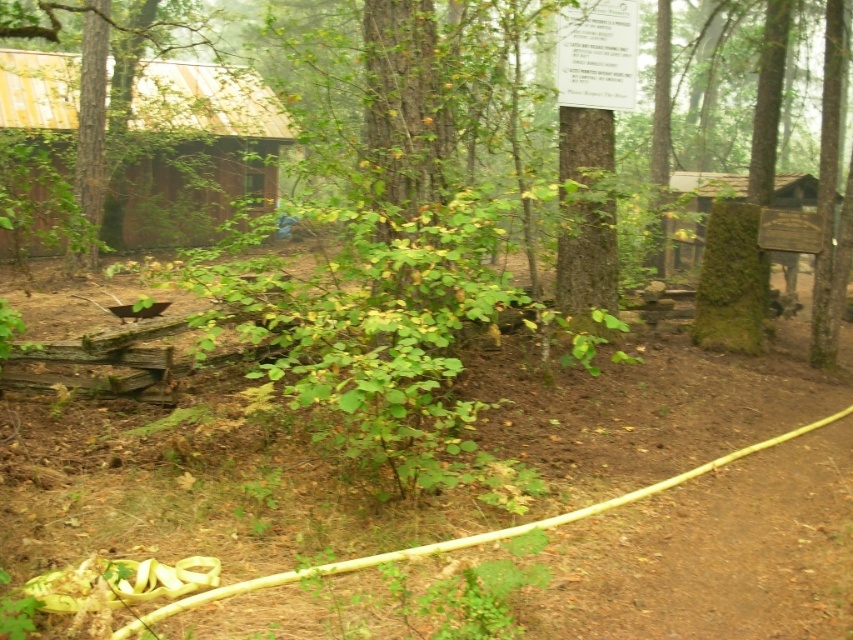
From the picture: Does yellow rubber hose at lower center have a larger size compared to green mossy sign at upper right?

No, yellow rubber hose at lower center is not bigger than green mossy sign at upper right.

Between point (142, 435) and point (680, 268), which one is positioned behind?

The point (680, 268) is more distant.

Locate an element on the screen. The height and width of the screenshot is (640, 853). yellow rubber hose at lower center is located at coordinates (358, 486).

Is point (204, 163) less distant than point (701, 189)?

No, it is not.

I want to click on brown wooden cabin at left, so click(x=196, y=148).

The image size is (853, 640). Find the location of `brown wooden cabin at left`. brown wooden cabin at left is located at coordinates (196, 148).

Locate an element on the screen. brown wooden cabin at left is located at coordinates (196, 148).

Which of these two, yellow rubber hose at lower center or brown wooden cabin at left, stands taller?

With more height is brown wooden cabin at left.

Is yellow rubber hose at lower center thinner than brown wooden cabin at left?

No.

Is point (618, 604) farther from camera compared to point (175, 236)?

No, it is not.

This screenshot has height=640, width=853. I want to click on yellow rubber hose at lower center, so click(x=358, y=486).